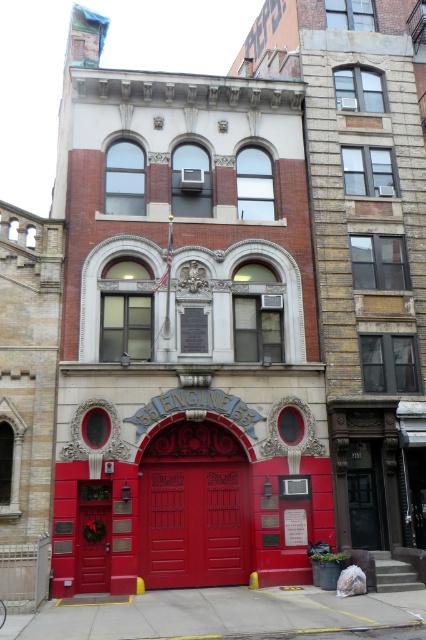
Question: Which object appears farthest from the camera in this image?

Choices:
 (A) matte red door at center
 (B) smooth glossy red doors at center

Answer: (B)

Question: Observing the image, what is the correct spatial positioning of smooth glossy red doors at center in reference to matte red door at center?

Choices:
 (A) below
 (B) above

Answer: (B)

Question: Which point is farther to the camera?

Choices:
 (A) (166, 464)
 (B) (101, 536)

Answer: (A)

Question: Is smooth glossy red doors at center smaller than matte red door at center?

Choices:
 (A) no
 (B) yes

Answer: (A)

Question: Can you confirm if smooth glossy red doors at center is thinner than matte red door at center?

Choices:
 (A) no
 (B) yes

Answer: (A)